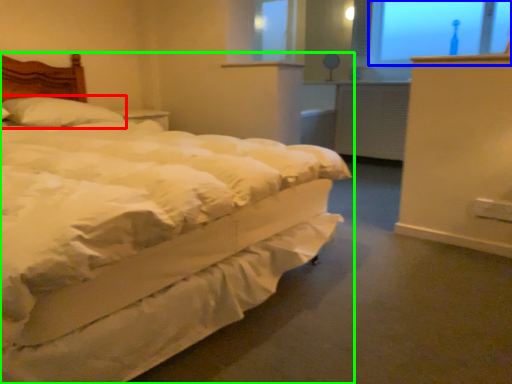
Question: Considering the real-world distances, which object is closest to pillow (highlighted by a red box)? window screen (highlighted by a blue box) or bed (highlighted by a green box).

Choices:
 (A) window screen
 (B) bed

Answer: (B)